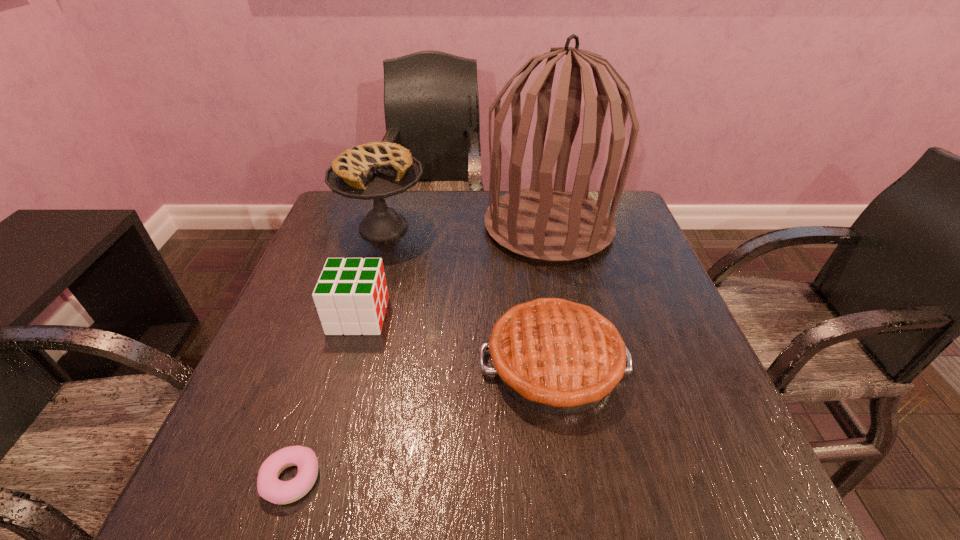
Locate an element on the screen. birdcage is located at coordinates (552, 224).

Find the location of `the taller pie`. the taller pie is located at coordinates (377, 170).

Image resolution: width=960 pixels, height=540 pixels. Identify the location of the fourth shortest object. (377, 170).

Identify the location of cube. (351, 296).

Identify the location of the shorter pie. The width and height of the screenshot is (960, 540). (556, 356).

At what (x,y) coordinates should I click in order to perform the action: click on the right pie. Please return your answer as a coordinate pair (x, y). Looking at the image, I should click on (556, 356).

Image resolution: width=960 pixels, height=540 pixels. What are the coordinates of `the nearest object` in the screenshot? It's located at click(x=269, y=487).

Where is `pastry`? pastry is located at coordinates (269, 487).

Locate an element on the screen. This screenshot has height=540, width=960. free space located on the front of the birdcage is located at coordinates (587, 409).

Locate an element on the screen. The width and height of the screenshot is (960, 540). blank area located 0.240m on the cut side of the second tallest object is located at coordinates (355, 326).